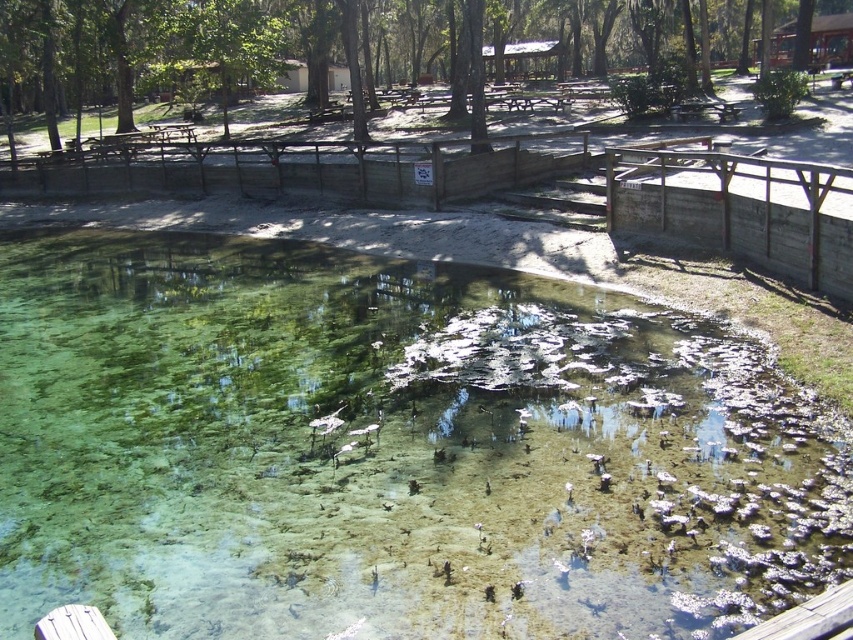
Does clear water at center have a lesser width compared to green leafy tree at upper center?

Indeed, clear water at center has a lesser width compared to green leafy tree at upper center.

This screenshot has width=853, height=640. Describe the element at coordinates (392, 451) in the screenshot. I see `clear water at center` at that location.

Between point (15, 634) and point (310, 10), which one is positioned behind?

Positioned behind is point (310, 10).

Where is `clear water at center`? The height and width of the screenshot is (640, 853). clear water at center is located at coordinates (392, 451).